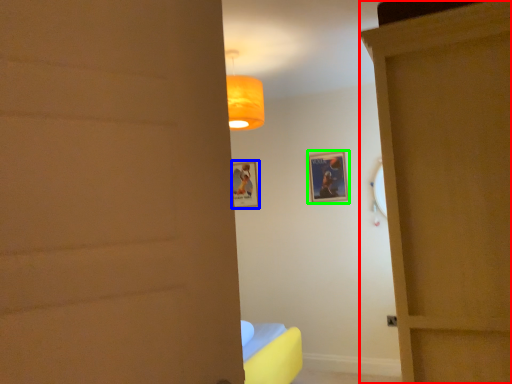
Question: Which object is the farthest from door (highlighted by a red box)? Choose among these: picture frame (highlighted by a blue box) or picture frame (highlighted by a green box).

Choices:
 (A) picture frame
 (B) picture frame

Answer: (A)